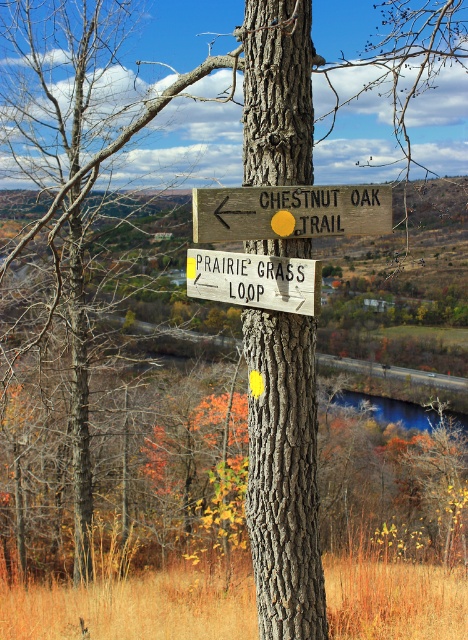
From the picture: You are a hiker trying to read the trail signs on the gray textured tree trunk at center and the white wooden sign at center. Which object would you need to move closer to in order to read the text more clearly?

The gray textured tree trunk at center is thinner than the white wooden sign at center, so you would need to move closer to the gray textured tree trunk at center to read the text more clearly because it is narrower and might have smaller text or details that are harder to see from a distance.